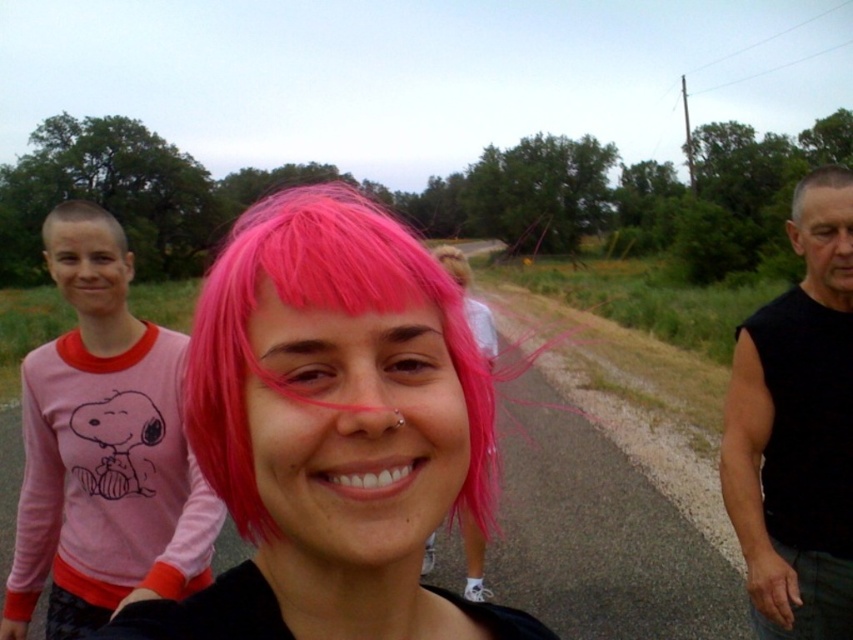
Question: Is pink matte wig at center smaller than pink fabric shirt at left?

Choices:
 (A) no
 (B) yes

Answer: (B)

Question: Which object appears farthest from the camera in this image?

Choices:
 (A) gray matte hair at upper right
 (B) pink matte wig at center
 (C) pink fabric shirt at left
 (D) short blonde hair at left

Answer: (A)

Question: Can you confirm if pink matte wig at center is smaller than black sleeveless shirt at right?

Choices:
 (A) no
 (B) yes

Answer: (A)

Question: Can you confirm if short blonde hair at left is positioned below gray matte hair at upper right?

Choices:
 (A) no
 (B) yes

Answer: (B)

Question: Which point is closer to the camera?

Choices:
 (A) short blonde hair at left
 (B) pink matte wig at center

Answer: (B)

Question: Estimate the real-world distances between objects in this image. Which object is farther from the pink matte wig at center?

Choices:
 (A) black sleeveless shirt at right
 (B) pink fabric shirt at left
 (C) gray matte hair at upper right
 (D) short blonde hair at left

Answer: (D)